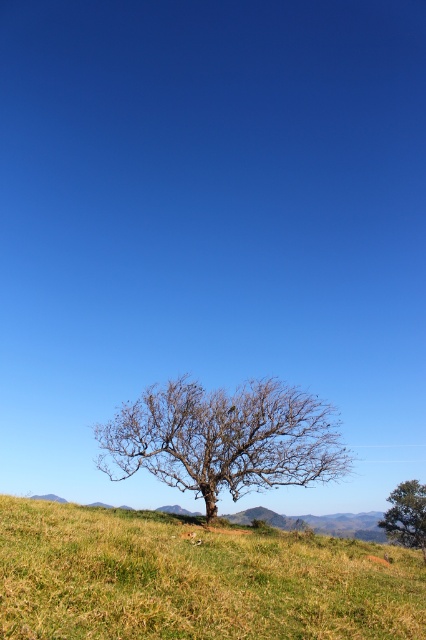
Question: Which object is positioned farthest from the green grassy hillside at lower center?

Choices:
 (A) bare branches at center
 (B) green leafy tree at center

Answer: (B)

Question: Is green grassy hillside at lower center bigger than bare branches at center?

Choices:
 (A) yes
 (B) no

Answer: (A)

Question: Which point is closer to the camera?

Choices:
 (A) (11, 506)
 (B) (144, 400)

Answer: (A)

Question: Is green grassy hillside at lower center smaller than green leafy tree at center?

Choices:
 (A) no
 (B) yes

Answer: (A)

Question: Which object is the closest to the green leafy tree at center?

Choices:
 (A) green grassy hillside at lower center
 (B) bare branches at center

Answer: (B)

Question: Is green grassy hillside at lower center bigger than green leafy tree at center?

Choices:
 (A) yes
 (B) no

Answer: (A)